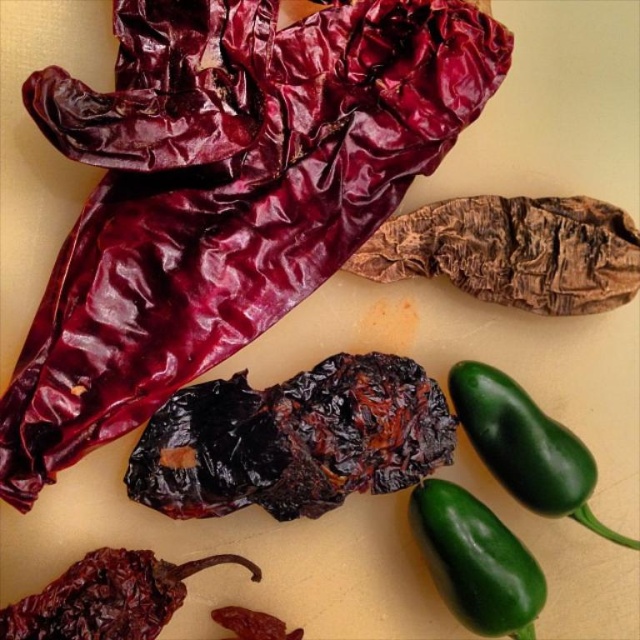
You are a photographer standing at a certain distance from the scene. You want to capture a closeup shot of the charcoal black dried chili pepper at center. Based on the given information, is the current distance sufficient to focus on this object without moving closer?

The charcoal black dried chili pepper at center is 4.01 feet away from the camera. A typical closeup requires the subject to be within 1 foot of the lens. Therefore, the current distance of 4.01 feet is too far to achieve a closeup without moving closer.